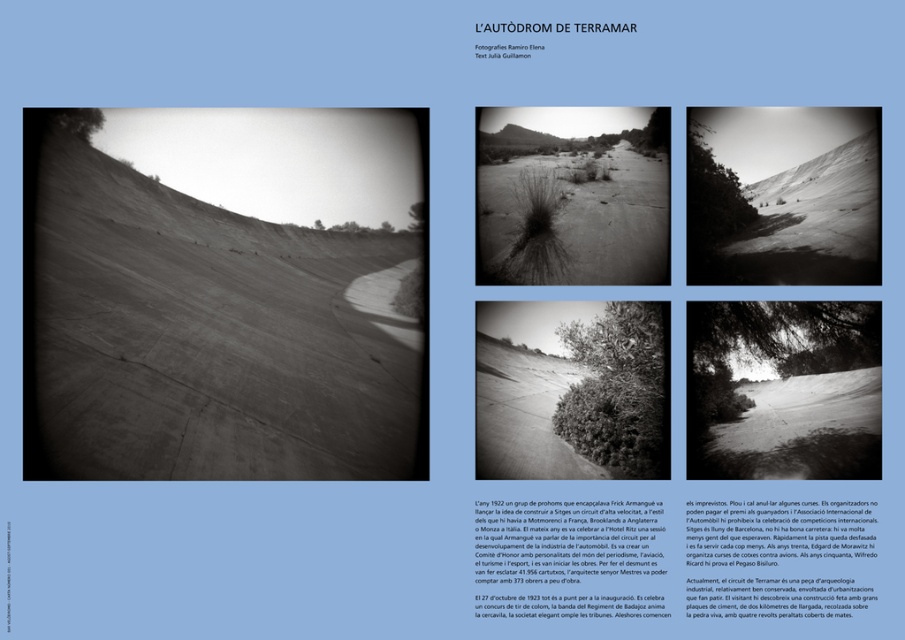
Can you confirm if smooth sand hill at left is positioned to the right of grainy sand hill at center?

No, smooth sand hill at left is not to the right of grainy sand hill at center.

Is smooth sand hill at left wider than grainy sand hill at center?

Correct, the width of smooth sand hill at left exceeds that of grainy sand hill at center.

At what (x,y) coordinates should I click in order to perform the action: click on smooth sand hill at left. Please return your answer as a coordinate pair (x, y). This screenshot has width=905, height=640. Looking at the image, I should click on (201, 337).

Is point (693, 234) farther from camera compared to point (570, 148)?

No, (693, 234) is in front of (570, 148).

Between point (870, 138) and point (599, 164), which one is positioned behind?

Point (870, 138)

You are a GUI agent. You are given a task and a screenshot of the screen. Output one action in this format:
    pyautogui.click(x=<x>, y=<y>)
    Task: Click on the smooth sand dune at center
    The height and width of the screenshot is (640, 905).
    Given the screenshot: What is the action you would take?
    pyautogui.click(x=783, y=195)

In the scene shown: Between smooth sand hill at left and smooth sand dune at center, which one has more height?

smooth sand hill at left is taller.

Does smooth sand hill at left have a greater width compared to smooth sand dune at center?

Incorrect, smooth sand hill at left's width does not surpass smooth sand dune at center's.

Which is behind, point (34, 154) or point (715, 198)?

The point (34, 154) is behind.

Locate an element on the screen. smooth sand hill at left is located at coordinates (201, 337).